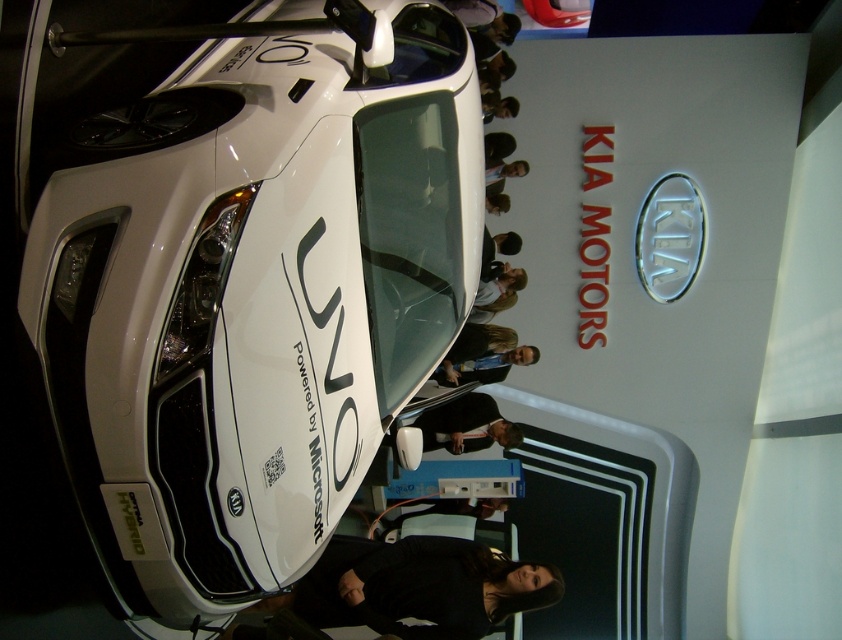
Does blue fabric shirt at center have a larger size compared to light brown hair at center?

Indeed, blue fabric shirt at center has a larger size compared to light brown hair at center.

Who is higher up, blue fabric shirt at center or light brown hair at center?

light brown hair at center is above.

Between point (473, 374) and point (485, 308), which one is positioned behind?

The point (485, 308) is behind.

Locate an element on the screen. The image size is (842, 640). blue fabric shirt at center is located at coordinates (483, 365).

Between point (425, 580) and point (485, 115), which one is positioned behind?

The point (485, 115) is behind.

Is point (454, 620) farther from viewer compared to point (489, 115)?

No, it is not.

Is point (312, 580) positioned before point (498, 115)?

Yes, it is.

Where is `black fabric at lower center`? The height and width of the screenshot is (640, 842). black fabric at lower center is located at coordinates (417, 586).

Can you confirm if dark brown leather jacket at center is positioned to the left of dark brown hair at upper center?

Correct, you'll find dark brown leather jacket at center to the left of dark brown hair at upper center.

Can you confirm if dark brown leather jacket at center is shorter than dark brown hair at upper center?

No, dark brown leather jacket at center is not shorter than dark brown hair at upper center.

Is point (480, 436) farther from viewer compared to point (488, 102)?

That is False.

In order to click on dark brown leather jacket at center in this screenshot , I will do `click(466, 426)`.